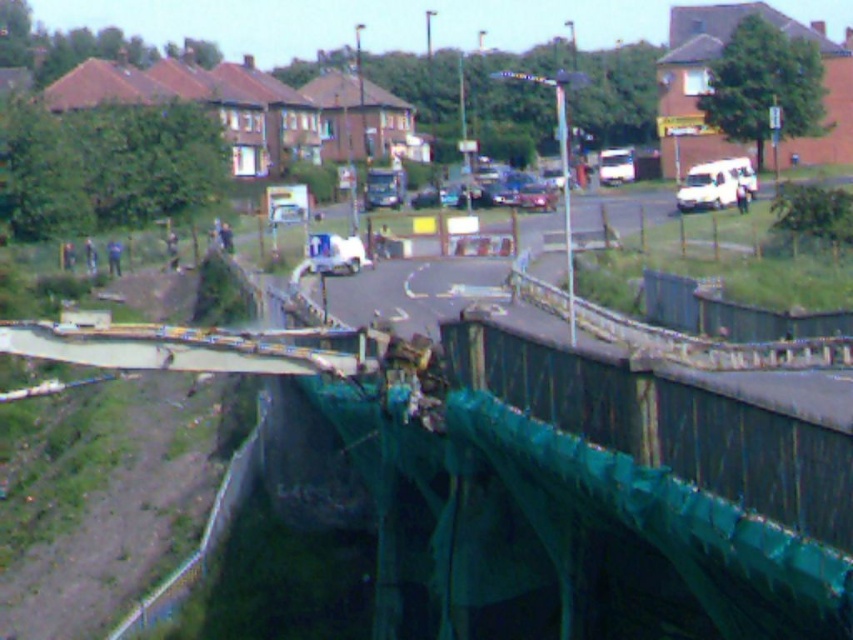
Question: Is the position of white matte van at upper right less distant than that of shiny silver car at center?

Choices:
 (A) yes
 (B) no

Answer: (A)

Question: Based on their relative distances, which object is nearer to the metallic gray bridge at center?

Choices:
 (A) shiny silver car at center
 (B) white matte van at upper right

Answer: (B)

Question: Which point is farther to the camera?

Choices:
 (A) white matte van at upper right
 (B) metallic gray bridge at center
 (C) white matte van at center
 (D) shiny silver car at center

Answer: (D)

Question: Among these objects, which one is nearest to the camera?

Choices:
 (A) white matte van at center
 (B) metallic gray bridge at center

Answer: (B)

Question: Can you confirm if metallic gray bridge at center is positioned to the left of white matte van at upper right?

Choices:
 (A) yes
 (B) no

Answer: (A)

Question: Does white matte van at upper right appear under shiny silver car at center?

Choices:
 (A) yes
 (B) no

Answer: (B)